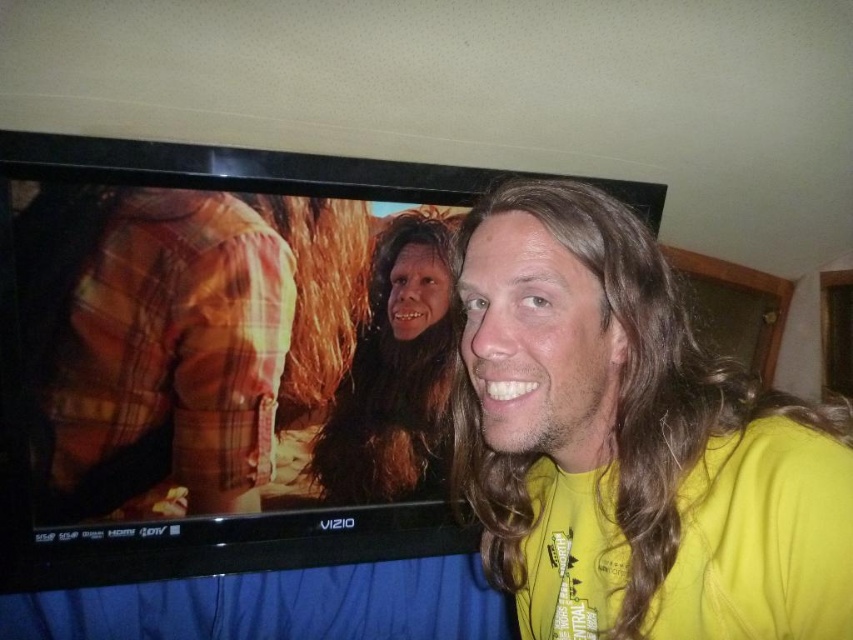
Based on the photo, you are a photographer trying to capture a photo of the black glossy tv at upper left and the brown fuzzy hair at center. Which object is taller in the image?

The black glossy tv at upper left is taller than the brown fuzzy hair at center according to the description.

You are standing in the room and want to reach both points on the TV screen. Which point, point [106,218] or point [386,365], is closer to you?

Point [106,218] is closer to the viewer than point [386,365].